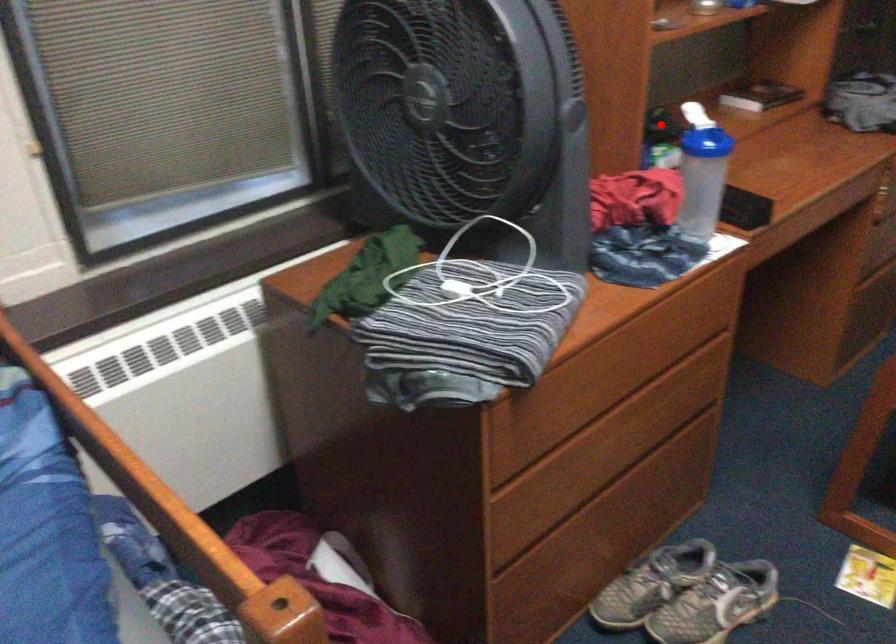
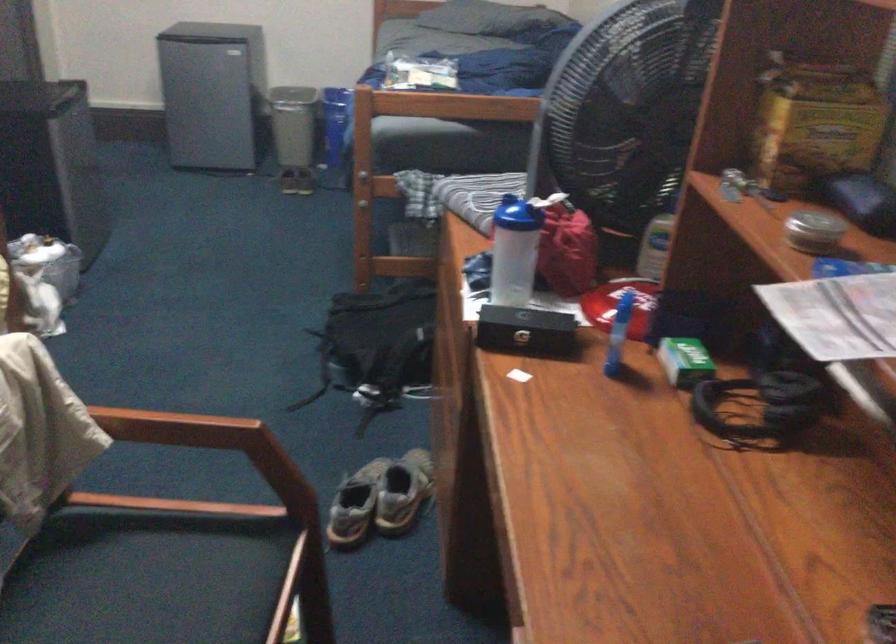
Find the pixel in the second image that matches the highlighted location in the first image.

(767, 397)